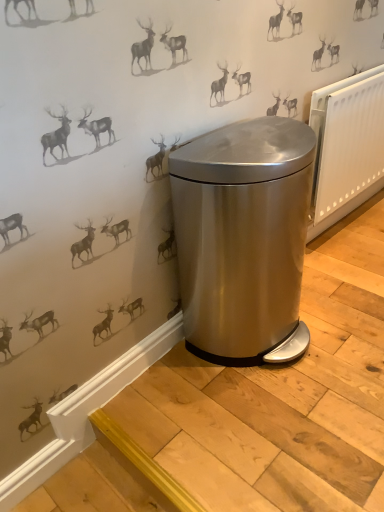
Locate an element on the screen. The height and width of the screenshot is (512, 384). vacant space in front of satin silver trash can at center is located at coordinates (272, 432).